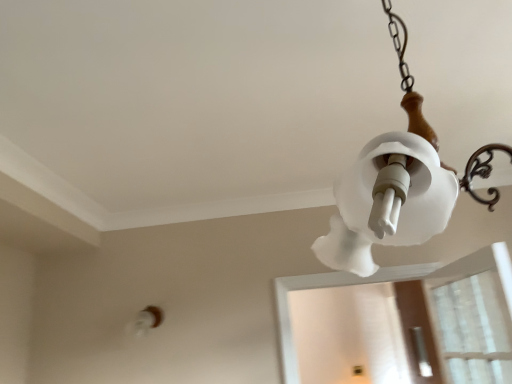
You are a GUI agent. You are given a task and a screenshot of the screen. Output one action in this format:
    pyautogui.click(x=<x>, y=<y>)
    Task: Click on the white frosted glass lampshade at upper right
    The width and height of the screenshot is (512, 384).
    Given the screenshot: What is the action you would take?
    pyautogui.click(x=398, y=184)

This screenshot has width=512, height=384. Find the location of `white frosted glass light fixture at lower left`. white frosted glass light fixture at lower left is located at coordinates (146, 321).

Measure the distance from transparent plastic screen door at lower right to white frosted glass lampshade at upper right.

The distance of transparent plastic screen door at lower right from white frosted glass lampshade at upper right is 7.18 feet.

From a real-world perspective, is transparent plastic screen door at lower right over white frosted glass lampshade at upper right?

No, from a real-world perspective, transparent plastic screen door at lower right is not over white frosted glass lampshade at upper right

Does transparent plastic screen door at lower right touch white frosted glass lampshade at upper right?

No, transparent plastic screen door at lower right is not with white frosted glass lampshade at upper right.

Where is `lamp in front of the transparent plastic screen door at lower right`? lamp in front of the transparent plastic screen door at lower right is located at coordinates (398, 184).

Is white frosted glass light fixture at lower left looking in the opposite direction of white frosted glass lampshade at upper right?

No.

Consider the image. Does white frosted glass light fixture at lower left have a smaller size compared to white frosted glass lampshade at upper right?

Yes.

Which of these two, white frosted glass light fixture at lower left or white frosted glass lampshade at upper right, is thinner?

white frosted glass light fixture at lower left.

From the image's perspective, who appears lower, white frosted glass light fixture at lower left or white frosted glass lampshade at upper right?

From the image's view, white frosted glass light fixture at lower left is below.

Between transparent plastic screen door at lower right and white frosted glass light fixture at lower left, which one has smaller size?

white frosted glass light fixture at lower left.

Is transparent plastic screen door at lower right situated inside white frosted glass light fixture at lower left or outside?

transparent plastic screen door at lower right exists outside the volume of white frosted glass light fixture at lower left.

Which of these two, transparent plastic screen door at lower right or white frosted glass light fixture at lower left, stands taller?

transparent plastic screen door at lower right is taller.

Is point (428, 342) farther from camera compared to point (146, 324)?

Yes, point (428, 342) is behind point (146, 324).

Considering the relative sizes of white frosted glass lampshade at upper right and transparent plastic screen door at lower right in the image provided, is white frosted glass lampshade at upper right bigger than transparent plastic screen door at lower right?

Indeed, white frosted glass lampshade at upper right has a larger size compared to transparent plastic screen door at lower right.

Find the location of a particular element. The height and width of the screenshot is (384, 512). lamp on the left side of transparent plastic screen door at lower right is located at coordinates (398, 184).

From the image's perspective, between white frosted glass lampshade at upper right and transparent plastic screen door at lower right, who is located below?

transparent plastic screen door at lower right, from the image's perspective.

Is point (408, 106) closer or farther from the camera than point (416, 285)?

Point (408, 106) appears to be closer to the viewer than point (416, 285).

From the image's perspective, is white frosted glass lampshade at upper right located above or below white frosted glass light fixture at lower left?

white frosted glass lampshade at upper right is situated higher than white frosted glass light fixture at lower left in the image.

Considering the points (356, 173) and (145, 320), which point is in front, point (356, 173) or point (145, 320)?

Positioned in front is point (356, 173).

Which object is further away from the camera, white frosted glass lampshade at upper right or white frosted glass light fixture at lower left?

white frosted glass light fixture at lower left.

Does white frosted glass lampshade at upper right turn towards white frosted glass light fixture at lower left?

No, white frosted glass lampshade at upper right is not oriented towards white frosted glass light fixture at lower left.

You are a GUI agent. You are given a task and a screenshot of the screen. Output one action in this format:
    pyautogui.click(x=<x>, y=<y>)
    Task: Click on the screen door on the right of white frosted glass light fixture at lower left
    This screenshot has width=512, height=384.
    Given the screenshot: What is the action you would take?
    pyautogui.click(x=417, y=332)

Is white frosted glass light fixture at lower left wider or thinner than transparent plastic screen door at lower right?

white frosted glass light fixture at lower left is wider than transparent plastic screen door at lower right.

Is white frosted glass light fixture at lower left turned away from transparent plastic screen door at lower right?

No, transparent plastic screen door at lower right is not at the back of white frosted glass light fixture at lower left.

At what (x,y) coordinates should I click in order to perform the action: click on lamp in front of the transparent plastic screen door at lower right. Please return your answer as a coordinate pair (x, y). The width and height of the screenshot is (512, 384). Looking at the image, I should click on (398, 184).

Identify the location of light fixture that is on the left side of white frosted glass lampshade at upper right. (146, 321).

Considering their positions, is white frosted glass light fixture at lower left positioned closer to transparent plastic screen door at lower right than white frosted glass lampshade at upper right?

white frosted glass light fixture at lower left is closer to transparent plastic screen door at lower right.

From the image, which object appears to be nearer to transparent plastic screen door at lower right, white frosted glass lampshade at upper right or white frosted glass light fixture at lower left?

white frosted glass light fixture at lower left is positioned closer to the anchor transparent plastic screen door at lower right.

When comparing their distances from white frosted glass lampshade at upper right, does transparent plastic screen door at lower right or white frosted glass light fixture at lower left seem closer?

white frosted glass light fixture at lower left.

Estimate the real-world distances between objects in this image. Which object is further from white frosted glass lampshade at upper right, white frosted glass light fixture at lower left or transparent plastic screen door at lower right?

Among the two, transparent plastic screen door at lower right is located further to white frosted glass lampshade at upper right.

Looking at the image, which one is located closer to white frosted glass light fixture at lower left, transparent plastic screen door at lower right or white frosted glass lampshade at upper right?

transparent plastic screen door at lower right.

Estimate the real-world distances between objects in this image. Which object is closer to white frosted glass light fixture at lower left, white frosted glass lampshade at upper right or transparent plastic screen door at lower right?

The object closer to white frosted glass light fixture at lower left is transparent plastic screen door at lower right.

I want to click on light fixture located between white frosted glass lampshade at upper right and transparent plastic screen door at lower right in the depth direction, so click(x=146, y=321).